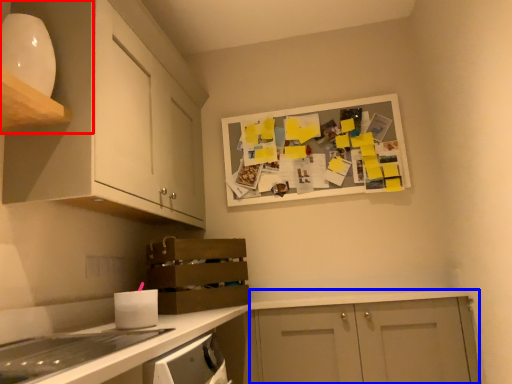
Question: Which object appears farthest to the camera in this image, cabinetry (highlighted by a red box) or cabinetry (highlighted by a blue box)?

Choices:
 (A) cabinetry
 (B) cabinetry

Answer: (B)